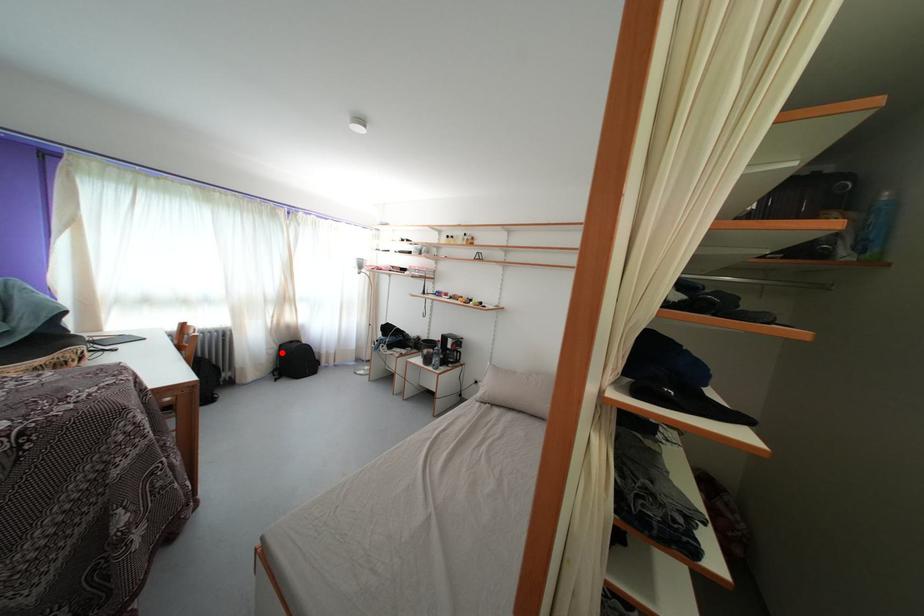
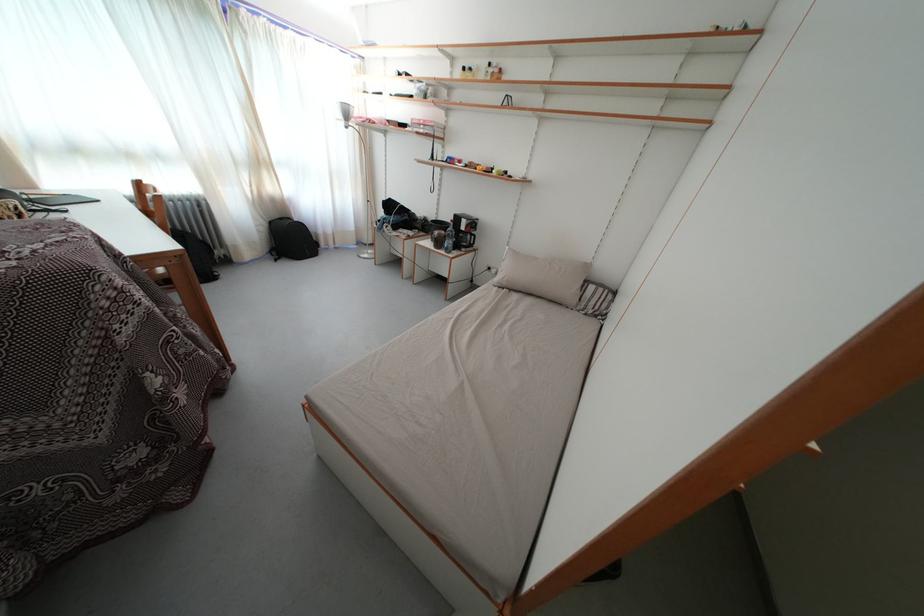
Question: I am providing you with two images of the same scene from different viewpoints. Given a red point in image1, look at the same physical point in image2. Is it:

Choices:
 (A) Closer to the viewpoint
 (B) Farther from the viewpoint

Answer: (A)